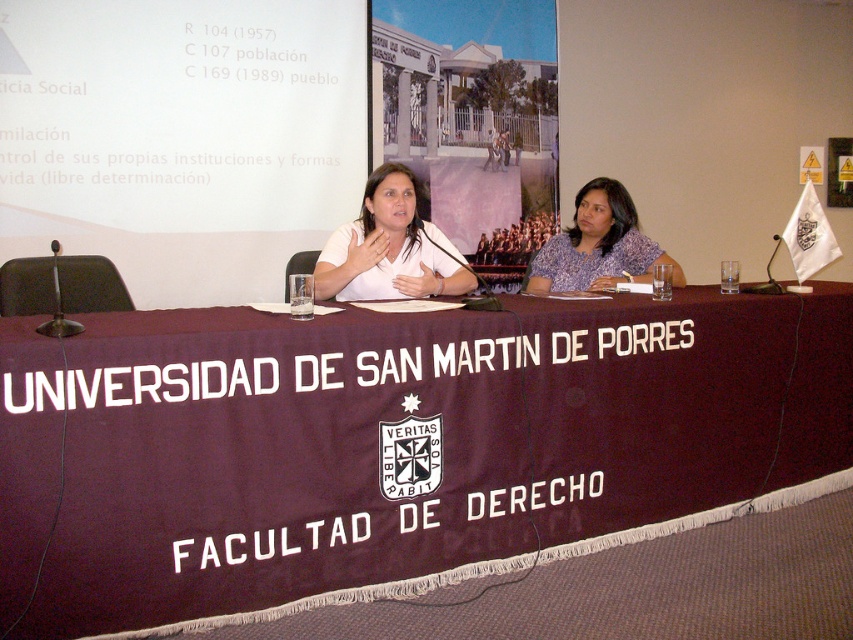
Question: Among these points, which one is nearest to the camera?

Choices:
 (A) (814, 465)
 (B) (550, 259)
 (C) (384, 259)

Answer: (C)

Question: Does maroon fabric table at center appear on the right side of purple printed blouse at center?

Choices:
 (A) yes
 (B) no

Answer: (B)

Question: Does maroon fabric table at center appear on the left side of purple printed blouse at center?

Choices:
 (A) no
 (B) yes

Answer: (B)

Question: Which object is positioned closest to the maroon fabric table at center?

Choices:
 (A) purple printed blouse at center
 (B) white matte shirt at center

Answer: (B)

Question: Can you confirm if maroon fabric table at center is positioned below white matte shirt at center?

Choices:
 (A) no
 (B) yes

Answer: (B)

Question: Which point appears farthest from the camera in this image?

Choices:
 (A) (363, 237)
 (B) (546, 266)

Answer: (B)